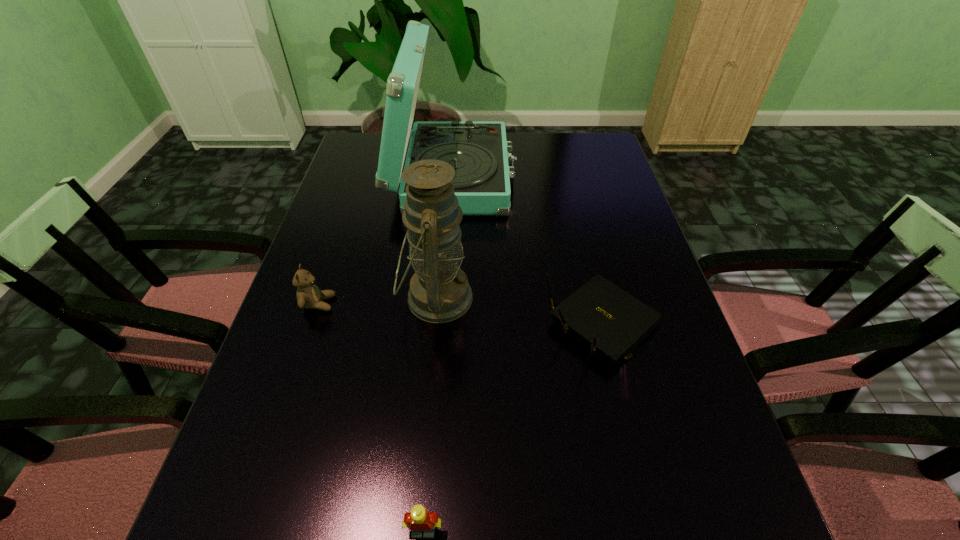
Where is `the farthest object`? The width and height of the screenshot is (960, 540). the farthest object is located at coordinates (478, 151).

The image size is (960, 540). Find the location of `oil lamp`. oil lamp is located at coordinates (439, 292).

The height and width of the screenshot is (540, 960). I want to click on the leftmost object, so click(x=309, y=296).

The width and height of the screenshot is (960, 540). Find the location of `the rightmost object`. the rightmost object is located at coordinates (613, 321).

Where is `Lego`? This screenshot has height=540, width=960. Lego is located at coordinates (419, 521).

Locate an element on the screen. Image resolution: width=960 pixels, height=540 pixels. vacant point located 0.080m on the face side of the farthest object is located at coordinates (540, 177).

This screenshot has height=540, width=960. In order to click on free space located 0.240m on the back of the oil lamp in this screenshot , I will do `click(444, 206)`.

Identify the location of vacant area located 0.200m on the front-facing side of the teddy bear. The height and width of the screenshot is (540, 960). (420, 303).

Find the location of a particular element. This screenshot has width=960, height=540. vacant region located on the front of the rightmost object is located at coordinates (623, 400).

Find the location of a particular element. This screenshot has height=540, width=960. object situated at the far edge is located at coordinates (478, 151).